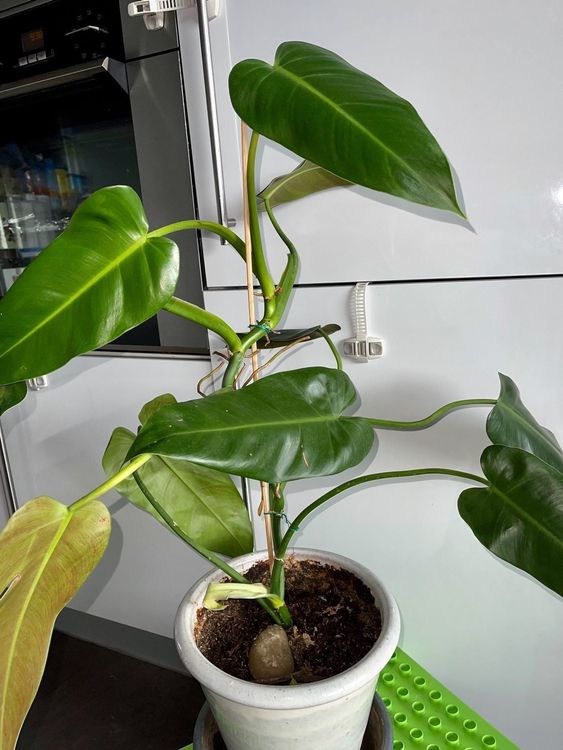
Locate an element on the screen. latch is located at coordinates (136, 0).